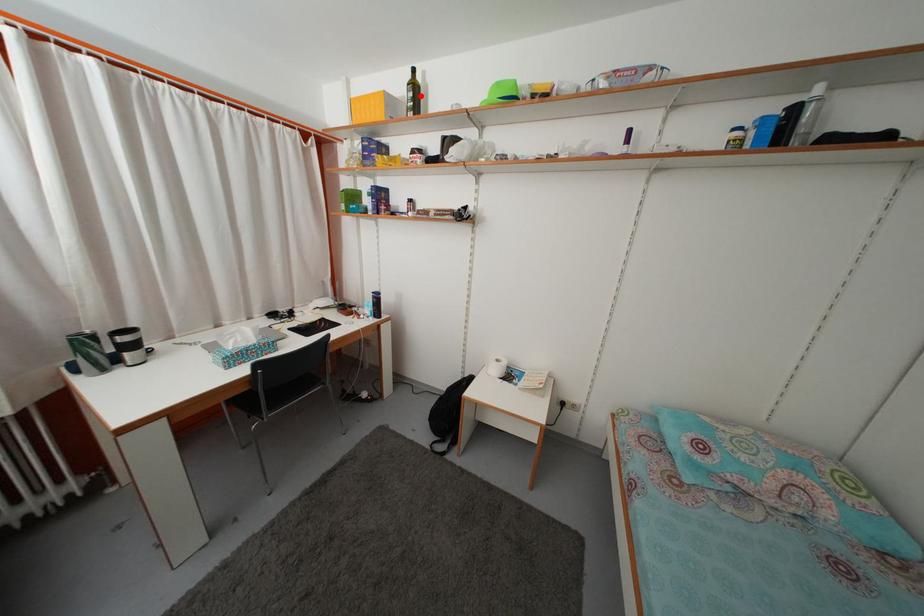
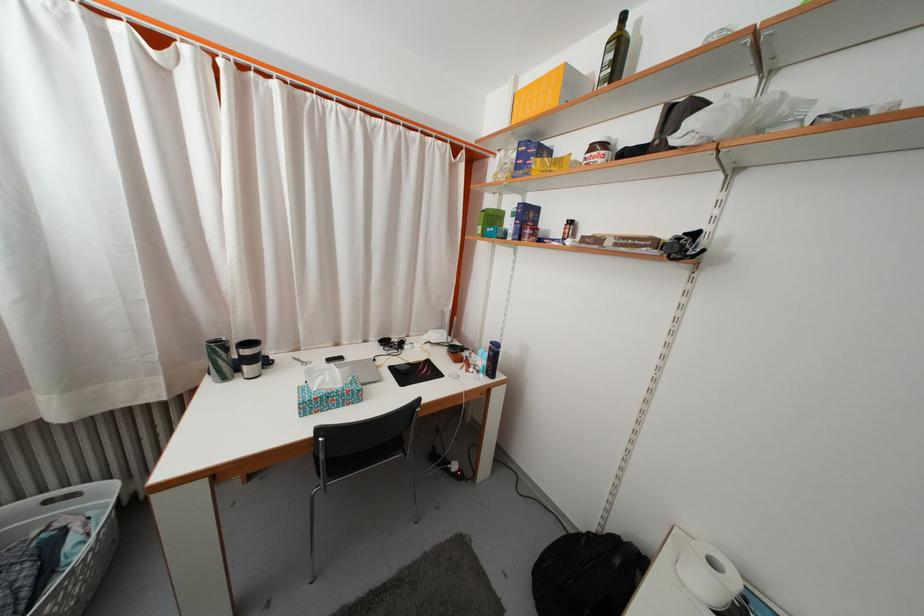
Where in the second image is the point corresponding to the highlighted location from the first image?

(625, 54)